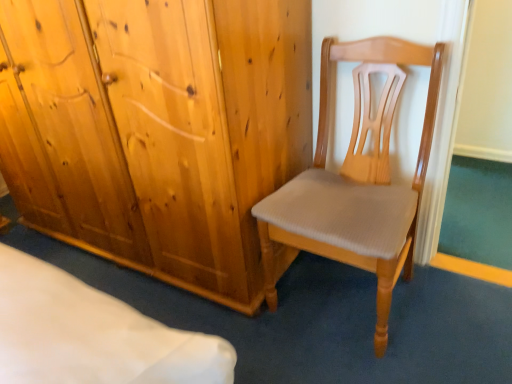
Question: Considering the relative sizes of natural wood wardrobe at center and light brown wood chair at center in the image provided, is natural wood wardrobe at center smaller than light brown wood chair at center?

Choices:
 (A) no
 (B) yes

Answer: (A)

Question: Is natural wood wardrobe at center not close to light brown wood chair at center?

Choices:
 (A) yes
 (B) no

Answer: (B)

Question: Does natural wood wardrobe at center have a greater width compared to light brown wood chair at center?

Choices:
 (A) no
 (B) yes

Answer: (B)

Question: Can you confirm if natural wood wardrobe at center is shorter than light brown wood chair at center?

Choices:
 (A) yes
 (B) no

Answer: (B)

Question: Does natural wood wardrobe at center come behind light brown wood chair at center?

Choices:
 (A) yes
 (B) no

Answer: (A)

Question: Could light brown wood chair at center be considered to be inside natural wood wardrobe at center?

Choices:
 (A) yes
 (B) no

Answer: (B)

Question: Is light brown wood chair at center located outside natural wood wardrobe at center?

Choices:
 (A) no
 (B) yes

Answer: (B)

Question: Does light brown wood chair at center have a lesser height compared to natural wood wardrobe at center?

Choices:
 (A) yes
 (B) no

Answer: (A)

Question: Is natural wood wardrobe at center completely or partially inside light brown wood chair at center?

Choices:
 (A) no
 (B) yes

Answer: (A)

Question: From a real-world perspective, is light brown wood chair at center located higher than natural wood wardrobe at center?

Choices:
 (A) no
 (B) yes

Answer: (A)

Question: Is light brown wood chair at center taller than natural wood wardrobe at center?

Choices:
 (A) yes
 (B) no

Answer: (B)

Question: Does light brown wood chair at center appear on the right side of natural wood wardrobe at center?

Choices:
 (A) yes
 (B) no

Answer: (A)

Question: Is natural wood wardrobe at center situated inside light brown wood chair at center or outside?

Choices:
 (A) outside
 (B) inside

Answer: (A)